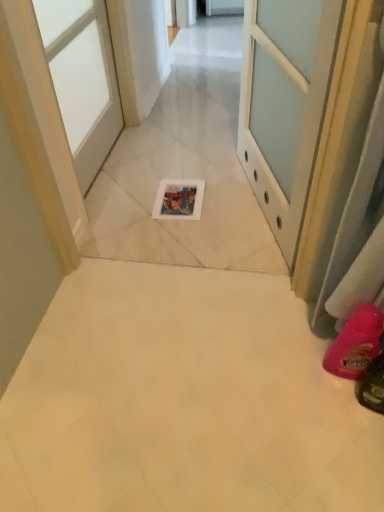
Identify the location of free point to the right of white glossy door at upper left, acting as the 1th door starting from the left. The height and width of the screenshot is (512, 384). 178,172.